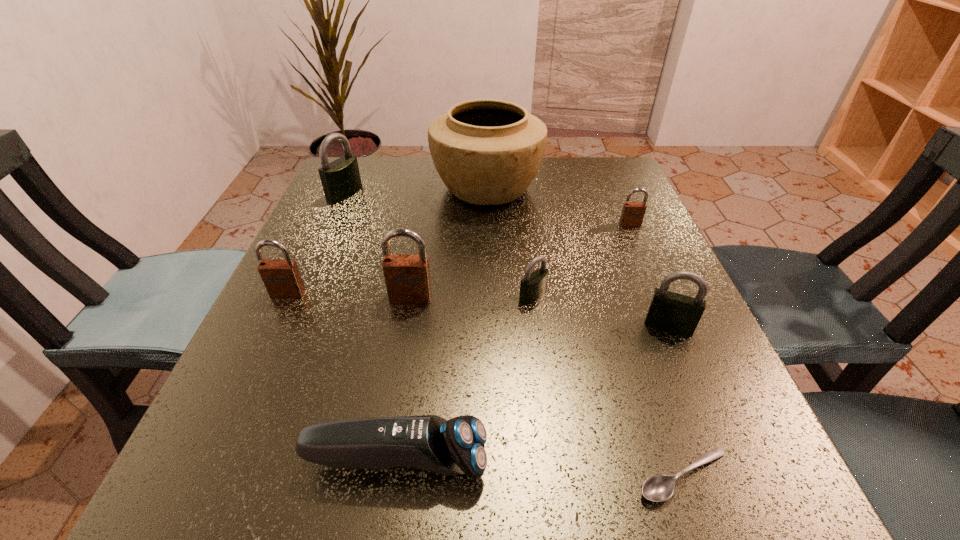
Locate an element on the screen. Image resolution: width=960 pixels, height=540 pixels. the seventh nearest object is located at coordinates (632, 215).

Locate an element on the screen. The image size is (960, 540). the fifth nearest padlock is located at coordinates (632, 215).

Locate an element on the screen. The image size is (960, 540). electric shaver is located at coordinates (456, 446).

Image resolution: width=960 pixels, height=540 pixels. Identify the location of gray soupspoon. (657, 488).

Find the location of a particular element. The width and height of the screenshot is (960, 540). the shortest object is located at coordinates (x=657, y=488).

Where is `vacant area situated on the front of the pottery`? The height and width of the screenshot is (540, 960). vacant area situated on the front of the pottery is located at coordinates [490, 314].

In order to click on free space located 0.220m on the right of the biggest black padlock in this screenshot , I will do `click(452, 194)`.

Identify the location of free space located 0.190m on the front-facing side of the second brown padlock from right to left. This screenshot has height=540, width=960. (394, 398).

This screenshot has width=960, height=540. What are the coordinates of `blank space located 0.050m on the left of the nearest padlock` in the screenshot? It's located at (615, 326).

This screenshot has width=960, height=540. I want to click on vacant region located 0.110m on the front-facing side of the second biggest brown padlock, so click(x=263, y=347).